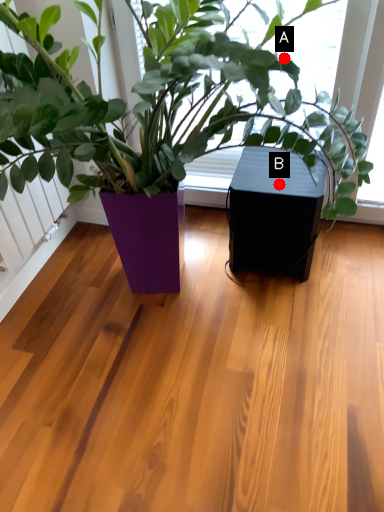
Question: Two points are circled on the image, labeled by A and B beside each circle. Which point is closer to the camera taking this photo?

Choices:
 (A) A is closer
 (B) B is closer

Answer: (A)